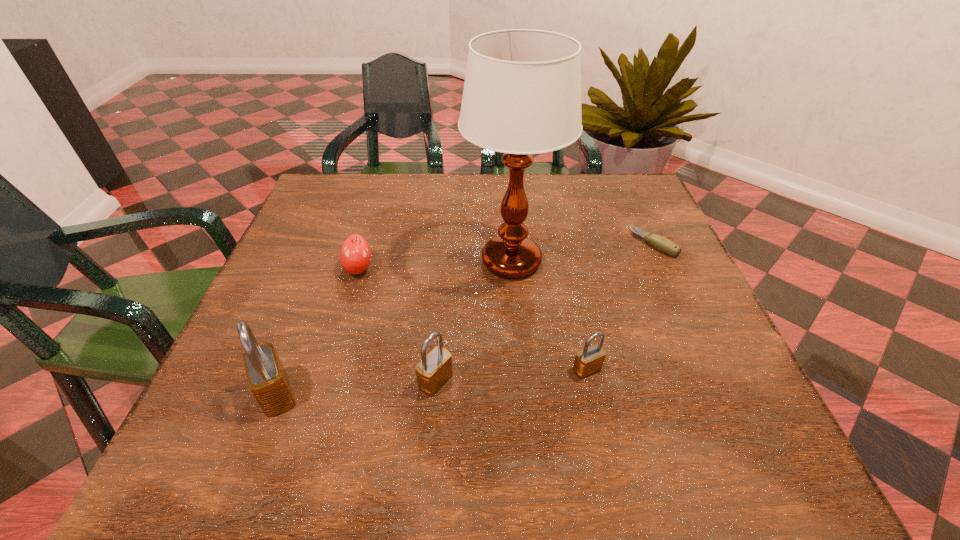
Where is `the fifth shortest object`? This screenshot has height=540, width=960. the fifth shortest object is located at coordinates (267, 379).

Locate an element on the screen. Image resolution: width=960 pixels, height=540 pixels. the leftmost padlock is located at coordinates (267, 379).

The width and height of the screenshot is (960, 540). I want to click on the third tallest object, so click(x=435, y=368).

Find the location of a particular element. the second shortest padlock is located at coordinates (435, 368).

The image size is (960, 540). In order to click on the shortest padlock in this screenshot , I will do `click(589, 360)`.

The width and height of the screenshot is (960, 540). I want to click on apple, so click(x=355, y=255).

I want to click on pocketknife, so click(662, 244).

What are the coordinates of `the shortest object` in the screenshot? It's located at [x=662, y=244].

Where is `the tallest object`? the tallest object is located at coordinates (522, 92).

The height and width of the screenshot is (540, 960). Identify the location of vacant space located on the right of the fifth shortest object. (433, 394).